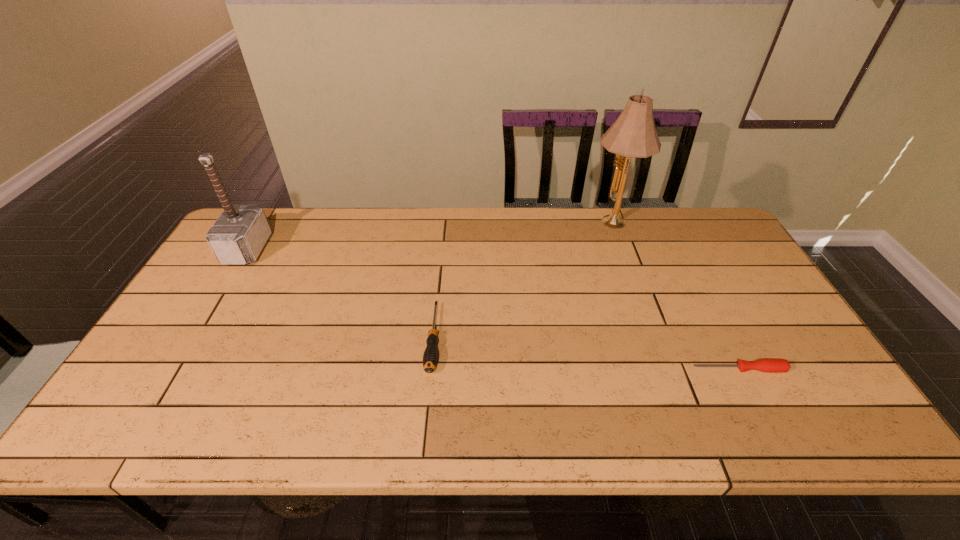
I want to click on the tallest object, so (x=633, y=135).

This screenshot has width=960, height=540. In order to click on hammer in this screenshot , I will do `click(239, 234)`.

The height and width of the screenshot is (540, 960). I want to click on the third shortest object, so click(x=239, y=234).

Where is `the second object from left to right`? the second object from left to right is located at coordinates (430, 357).

Find the location of a particular element. the second shortest object is located at coordinates (430, 357).

Where is `the shortest object`? The image size is (960, 540). the shortest object is located at coordinates (763, 365).

At what (x,y) coordinates should I click in order to perform the action: click on the right screwdriver. Please return your answer as a coordinate pair (x, y). Image resolution: width=960 pixels, height=540 pixels. Looking at the image, I should click on (763, 365).

Identify the location of free region located 0.300m on the front of the lampshade. The height and width of the screenshot is (540, 960). (641, 307).

This screenshot has width=960, height=540. Find the location of `vacant space located for striking with the head of the leftmost object`. vacant space located for striking with the head of the leftmost object is located at coordinates (329, 249).

Identify the location of free region located on the left of the third object from right to left. (384, 338).